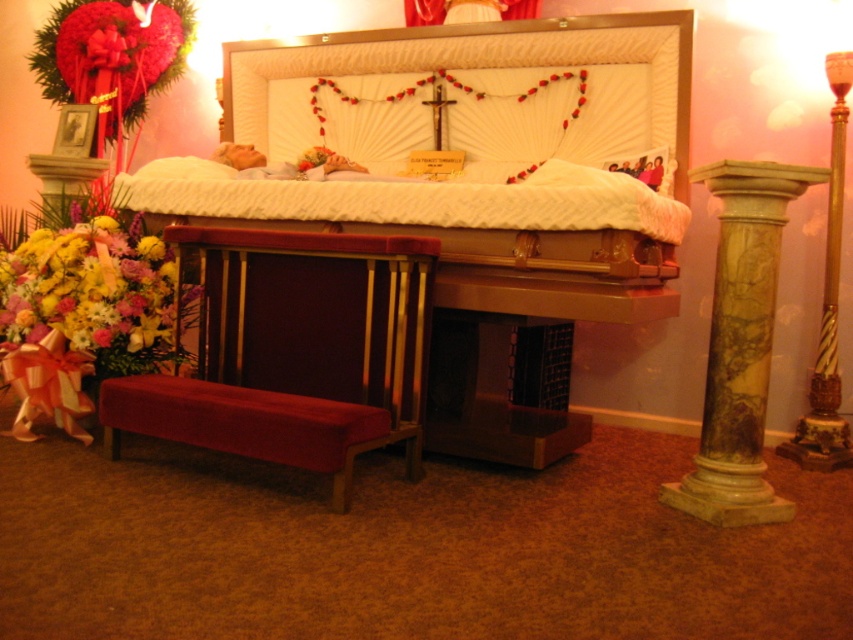
You are attending a funeral and need to sit down. You see a velvet red church bench at lower left and a green marble column at right. Which object is located to the left of the other?

The velvet red church bench at lower left is positioned on the left side of green marble column at right.